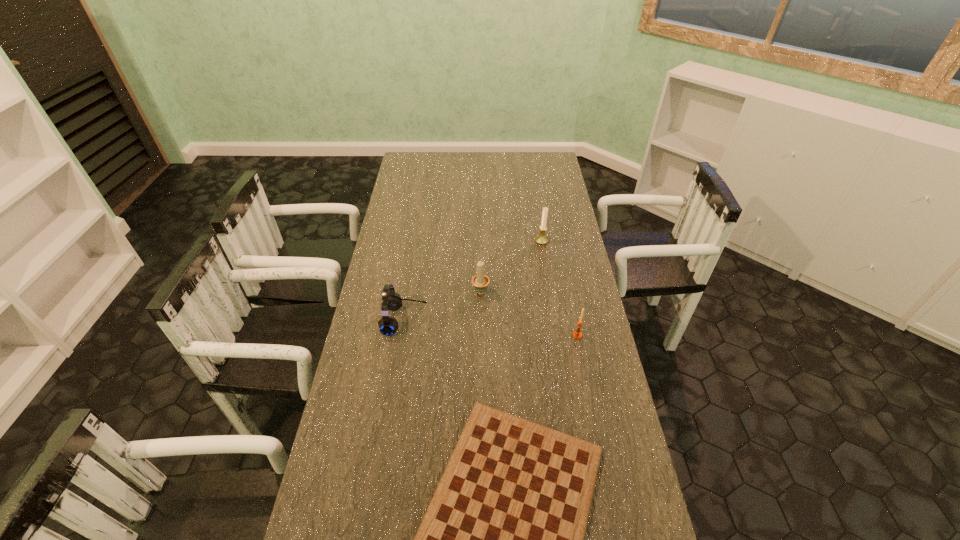
Where is `the second candle_holder from right to left`? the second candle_holder from right to left is located at coordinates (541, 239).

Locate an element on the screen. the farthest object is located at coordinates (541, 239).

The height and width of the screenshot is (540, 960). What are the coordinates of `the fourth nearest object` in the screenshot? It's located at (x=480, y=281).

Where is `the leftmost candle_holder`? the leftmost candle_holder is located at coordinates (480, 281).

The image size is (960, 540). Find the location of `the leftmost object`. the leftmost object is located at coordinates pos(392,301).

Identify the location of the rightmost candle_holder. (577, 334).

At what (x,y) coordinates should I click in order to perform the action: click on free space located on the right of the second candle_holder from right to left. Please return your answer as a coordinate pair (x, y). Looking at the image, I should click on (570, 241).

Image resolution: width=960 pixels, height=540 pixels. In order to click on free space located 0.110m on the handle side of the leftmost candle_holder in this screenshot , I will do `click(481, 263)`.

What are the coordinates of `vacant space located 0.250m on the handle side of the leftmost candle_holder` in the screenshot? It's located at (481, 240).

What are the coordinates of `vacant space located on the handle side of the leftmost candle_holder` in the screenshot? It's located at [481, 230].